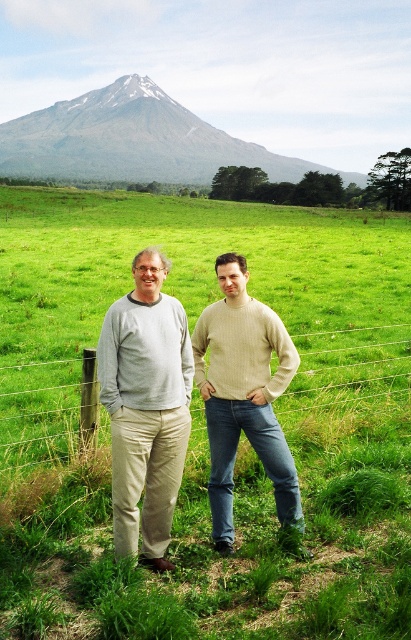
Can you confirm if light beige sweater at center is positioned below wire mesh fence at center?

Indeed, light beige sweater at center is positioned under wire mesh fence at center.

Is point (228, 532) closer to camera compared to point (30, 420)?

Yes.

What do you see at coordinates (244, 394) in the screenshot?
I see `light beige sweater at center` at bounding box center [244, 394].

Find the location of a particular element. The height and width of the screenshot is (640, 411). light beige sweater at center is located at coordinates (244, 394).

Between point (233, 449) and point (110, 104), which one is positioned behind?

The point (110, 104) is behind.

Locate an element on the screen. The width and height of the screenshot is (411, 640). light beige sweater at center is located at coordinates (244, 394).

Between light gray sweater at center and gray rocky mountain at upper center, which one appears on the left side from the viewer's perspective?

Positioned to the left is gray rocky mountain at upper center.

Is light gray sweater at center to the right of gray rocky mountain at upper center from the viewer's perspective?

Correct, you'll find light gray sweater at center to the right of gray rocky mountain at upper center.

Which is behind, point (154, 342) or point (339, 173)?

The point (339, 173) is behind.

Find the location of a particular element. This screenshot has width=411, height=640. light gray sweater at center is located at coordinates point(145,406).